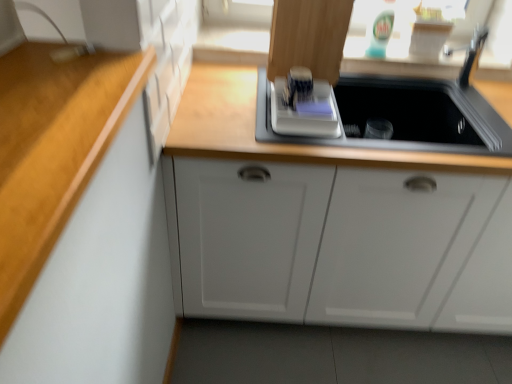
Where is `white plastic cutting board at upper center`? The height and width of the screenshot is (384, 512). white plastic cutting board at upper center is located at coordinates (304, 112).

Image resolution: width=512 pixels, height=384 pixels. Describe the element at coordinates (304, 112) in the screenshot. I see `white plastic cutting board at upper center` at that location.

In order to face white matte cabinet at center, should I rotate leftwards or rightwards?

Turn right by 18.219 degrees to look at white matte cabinet at center.

What is the approximate width of white matte cabinet at center?

It is 24.26 inches.

This screenshot has height=384, width=512. What do you see at coordinates (331, 243) in the screenshot?
I see `white matte cabinet at center` at bounding box center [331, 243].

Find the location of `white matte cabinet at center`. white matte cabinet at center is located at coordinates (331, 243).

Find the location of a particular element. The width and height of the screenshot is (512, 384). white plastic cutting board at upper center is located at coordinates (x=304, y=112).

Which object is positioned more to the left, white plastic cutting board at upper center or white matte cabinet at center?

Positioned to the left is white plastic cutting board at upper center.

Who is more distant, white plastic cutting board at upper center or white matte cabinet at center?

white plastic cutting board at upper center.

Does point (316, 103) appear closer or farther from the camera than point (304, 226)?

Point (316, 103).

Consider the image. From the image's perspective, which one is positioned lower, white plastic cutting board at upper center or white matte cabinet at center?

From the image's view, white matte cabinet at center is below.

From a real-world perspective, is white plastic cutting board at upper center physically below white matte cabinet at center?

Actually, white plastic cutting board at upper center is physically above white matte cabinet at center in the real world.

Considering the sizes of objects white plastic cutting board at upper center and white matte cabinet at center in the image provided, who is thinner, white plastic cutting board at upper center or white matte cabinet at center?

Thinner between the two is white plastic cutting board at upper center.

Which of these two, white plastic cutting board at upper center or white matte cabinet at center, stands shorter?

white plastic cutting board at upper center.

In the scene shown: Considering the relative sizes of white plastic cutting board at upper center and white matte cabinet at center in the image provided, is white plastic cutting board at upper center smaller than white matte cabinet at center?

Correct, white plastic cutting board at upper center occupies less space than white matte cabinet at center.

Is white matte cabinet at center completely or partially inside white plastic cutting board at upper center?

No, white plastic cutting board at upper center does not contain white matte cabinet at center.

Is white plastic cutting board at upper center directly adjacent to white matte cabinet at center?

white plastic cutting board at upper center and white matte cabinet at center are not in contact.

Is white plastic cutting board at upper center positioned with its back to white matte cabinet at center?

white plastic cutting board at upper center is not turned away from white matte cabinet at center.

How different are the orientations of white plastic cutting board at upper center and white matte cabinet at center in degrees?

white plastic cutting board at upper center and white matte cabinet at center are facing 0.000115 degrees away from each other.

Identify the location of cabinetry that is under the white plastic cutting board at upper center (from a real-world perspective). This screenshot has width=512, height=384. tap(331, 243).

Considering the positions of objects white matte cabinet at center and white plastic cutting board at upper center in the image provided, who is more to the right, white matte cabinet at center or white plastic cutting board at upper center?

white matte cabinet at center.

Is white matte cabinet at center in front of or behind white plastic cutting board at upper center in the image?

Clearly, white matte cabinet at center is in front of white plastic cutting board at upper center.

Is point (177, 202) behind point (314, 96)?

No, (177, 202) is in front of (314, 96).

From the image's perspective, does white matte cabinet at center appear higher than white plastic cutting board at upper center?

Actually, white matte cabinet at center appears below white plastic cutting board at upper center in the image.

From a real-world perspective, between white matte cabinet at center and white plastic cutting board at upper center, who is vertically lower?

white matte cabinet at center, from a real-world perspective.

Considering the relative sizes of white matte cabinet at center and white plastic cutting board at upper center in the image provided, is white matte cabinet at center thinner than white plastic cutting board at upper center?

Incorrect, the width of white matte cabinet at center is not less than that of white plastic cutting board at upper center.

Does white matte cabinet at center have a lesser height compared to white plastic cutting board at upper center?

Incorrect, the height of white matte cabinet at center does not fall short of that of white plastic cutting board at upper center.

Which of these two, white matte cabinet at center or white plastic cutting board at upper center, is smaller?

white plastic cutting board at upper center.

Is white matte cabinet at center inside or outside of white plastic cutting board at upper center?

white matte cabinet at center is outside white plastic cutting board at upper center.

Is white matte cabinet at center next to white plastic cutting board at upper center and touching it?

No, white matte cabinet at center is not touching white plastic cutting board at upper center.

Is white matte cabinet at center facing away from white plastic cutting board at upper center?

No, white matte cabinet at center is not facing away from white plastic cutting board at upper center.

How many degrees apart are the facing directions of white matte cabinet at center and white plastic cutting board at upper center?

The angle between the facing direction of white matte cabinet at center and the facing direction of white plastic cutting board at upper center is 0.000115 degrees.

Where is `cabinetry in front of the white plastic cutting board at upper center`? This screenshot has height=384, width=512. cabinetry in front of the white plastic cutting board at upper center is located at coordinates (331, 243).

In order to click on cabinetry below the white plastic cutting board at upper center (from the image's perspective) in this screenshot , I will do `click(331, 243)`.

The height and width of the screenshot is (384, 512). Identify the location of appliance that is behind the white matte cabinet at center. (304, 112).